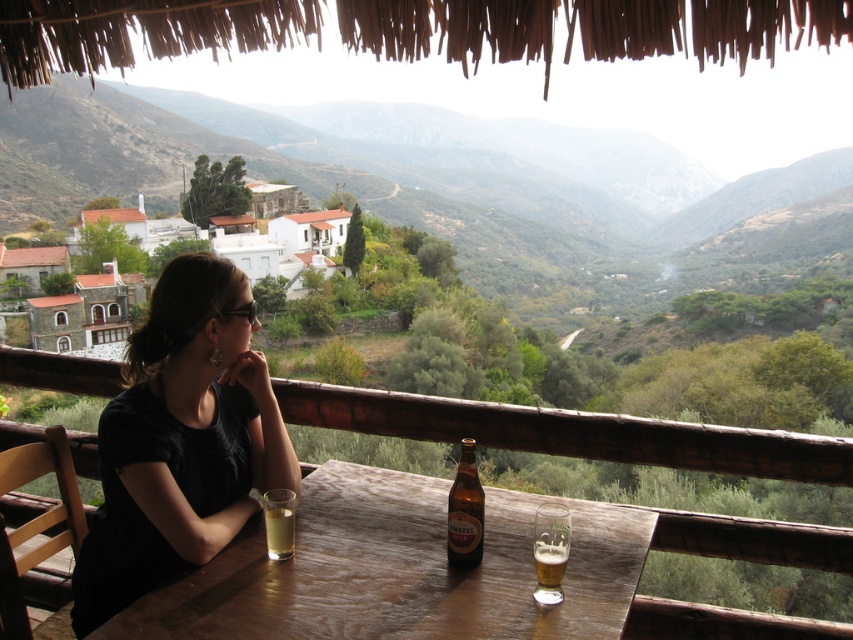
Question: Is brown glass bottle at table smaller than translucent glass beer at table center?

Choices:
 (A) yes
 (B) no

Answer: (B)

Question: Is black matte shirt at center below translucent glass at table left?

Choices:
 (A) no
 (B) yes

Answer: (A)

Question: Which object is closer to the camera taking this photo?

Choices:
 (A) wooden table at center
 (B) brown glass bottle at table
 (C) translucent glass beer at table center

Answer: (A)

Question: Which of the following is the closest to the observer?

Choices:
 (A) translucent glass beer at table center
 (B) brown glass bottle at table
 (C) black matte shirt at center
 (D) translucent glass at table left

Answer: (A)

Question: Which object is the farthest from the brown glass bottle at table?

Choices:
 (A) translucent glass at table left
 (B) black matte shirt at center

Answer: (B)

Question: Is black matte shirt at center to the right of translucent glass beer at table center from the viewer's perspective?

Choices:
 (A) no
 (B) yes

Answer: (A)